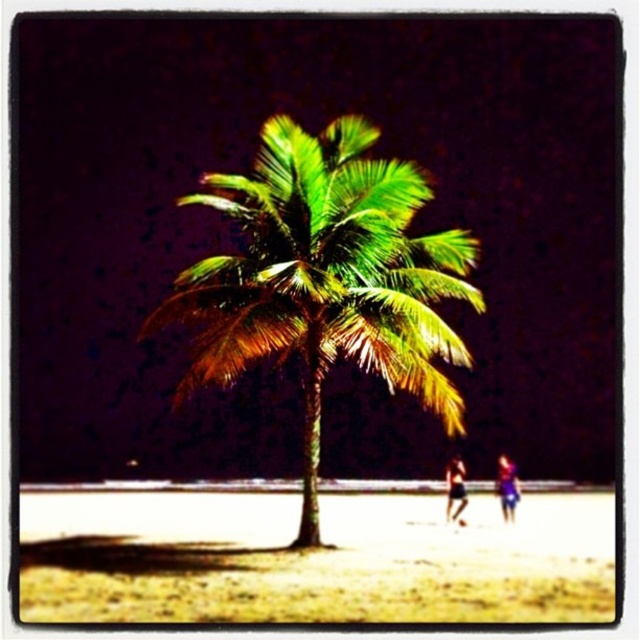
You are a photographer setting up a tripod on the beach. You notice the blue fabric at lower right and the dark blue fabric shorts at lower right in your shot. Which object should you adjust your camera angle to focus on if you want to capture the one that is higher in the frame?

The blue fabric at lower right is located above the dark blue fabric shorts at lower right, so you should focus on the blue fabric at lower right to capture the higher object in the frame.

You are a photographer setting up equipment on the beach. You have two items in your bag labeled as blue fabric at lower right and dark blue fabric shorts at lower right. Which item should you choose if you need a wider prop for a backdrop?

The blue fabric at lower right is wider than dark blue fabric shorts at lower right, so choose the blue fabric at lower right as the wider prop for a backdrop.